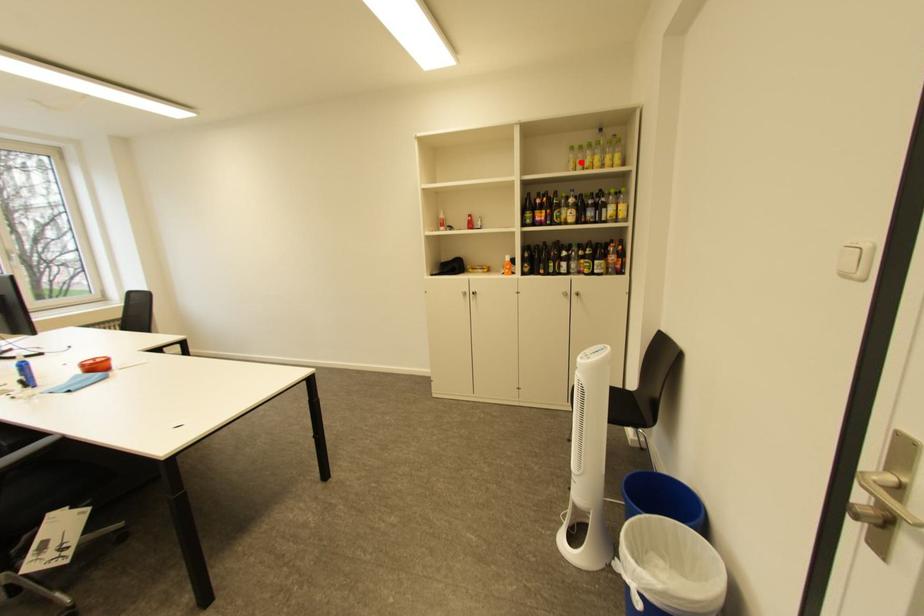
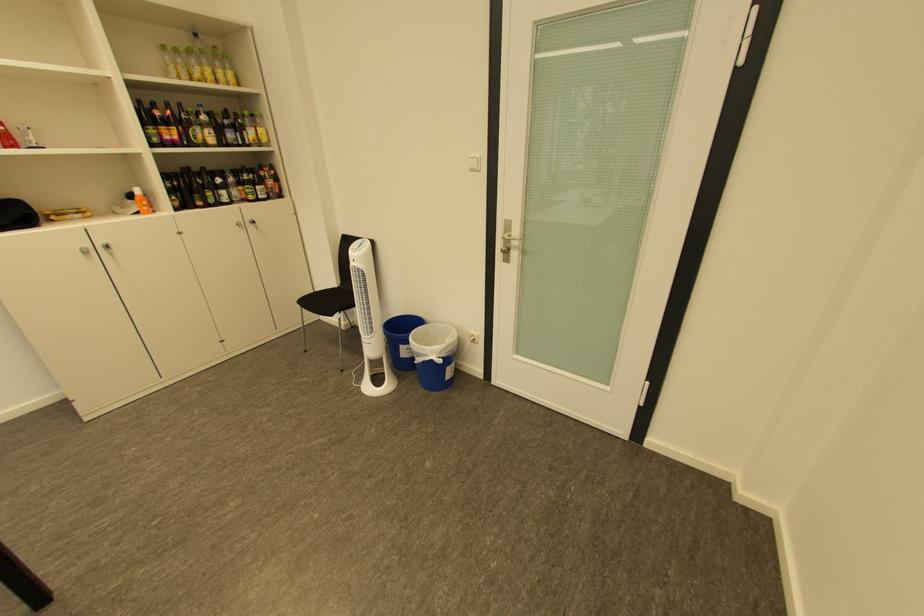
Find the pixel in the second image that matches the highlighted location in the first image.

(180, 66)